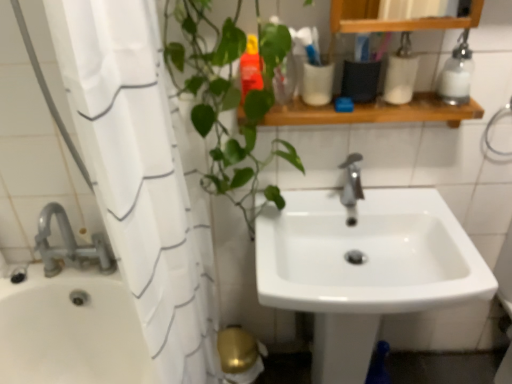
This screenshot has width=512, height=384. What do you see at coordinates (457, 73) in the screenshot? I see `clear glass soap dispenser at upper right` at bounding box center [457, 73].

Measure the distance between point (414, 250) and camera.

Point (414, 250) is 1.19 meters away from camera.

How much space does translucent orange bottle at upper center, placed as the second toiletry when sorted from right to left, occupy vertically?

translucent orange bottle at upper center, placed as the second toiletry when sorted from right to left, is 16.57 centimeters tall.

This screenshot has height=384, width=512. I want to click on translucent orange bottle at upper center, placed as the second toiletry when sorted from right to left, so click(250, 68).

This screenshot has height=384, width=512. What do you see at coordinates (140, 177) in the screenshot?
I see `white fabric shower curtain at left` at bounding box center [140, 177].

Where is `green leafy plant at left`? Image resolution: width=512 pixels, height=384 pixels. green leafy plant at left is located at coordinates (227, 100).

Can you confirm if clear glass soap dispenser at upper right is taller than white glossy container at upper right, the first toiletry viewed from the right?

Yes, clear glass soap dispenser at upper right is taller than white glossy container at upper right, the first toiletry viewed from the right.

How many degrees apart are the facing directions of clear glass soap dispenser at upper right and white glossy container at upper right, the first toiletry viewed from the right?

The facing directions of clear glass soap dispenser at upper right and white glossy container at upper right, the first toiletry viewed from the right, are 1.2 degrees apart.

Does point (469, 53) appear closer or farther from the camera than point (405, 35)?

Point (469, 53) is positioned farther from the camera compared to point (405, 35).

Is clear glass soap dispenser at upper right looking in the opposite direction of white glossy container at upper right, the first toiletry viewed from the right?

clear glass soap dispenser at upper right does not have its back to white glossy container at upper right, the first toiletry viewed from the right.

Is white fabric shower curtain at left looking in the opposite direction of white glossy container at upper right, the first toiletry viewed from the right?

No, white fabric shower curtain at left is not facing the opposite direction of white glossy container at upper right, the first toiletry viewed from the right.

Considering the sizes of objects white fabric shower curtain at left and white glossy container at upper right, which ranks as the second toiletry in left-to-right order, in the image provided, who is shorter, white fabric shower curtain at left or white glossy container at upper right, which ranks as the second toiletry in left-to-right order,?

white glossy container at upper right, which ranks as the second toiletry in left-to-right order, is shorter.

From the image's perspective, which one is positioned lower, white fabric shower curtain at left or white glossy container at upper right, which ranks as the second toiletry in left-to-right order?

From the image's view, white fabric shower curtain at left is below.

Which is nearer, [50,19] or [401,75]?

Positioned in front is point [50,19].

Which object is further away from the camera, white glossy container at upper right, the first toiletry viewed from the right, or green leafy plant at left?

white glossy container at upper right, the first toiletry viewed from the right, is further from the camera.

From the image's perspective, which object appears higher, white glossy container at upper right, which ranks as the second toiletry in left-to-right order, or green leafy plant at left?

white glossy container at upper right, which ranks as the second toiletry in left-to-right order, appears higher in the image.

Visually, is white glossy container at upper right, the first toiletry viewed from the right, positioned to the left or to the right of green leafy plant at left?

white glossy container at upper right, the first toiletry viewed from the right, is positioned on green leafy plant at left's right side.

Is white glossy container at upper right, the first toiletry viewed from the right, wider or thinner than green leafy plant at left?

Clearly, white glossy container at upper right, the first toiletry viewed from the right, has less width compared to green leafy plant at left.

From the image's perspective, relative to translucent orange bottle at upper center, positioned as the 1th toiletry in left-to-right order, is white glossy container at upper right, the first toiletry viewed from the right, above or below?

Clearly, from the image's perspective, white glossy container at upper right, the first toiletry viewed from the right, is above translucent orange bottle at upper center, positioned as the 1th toiletry in left-to-right order.

Would you say white glossy container at upper right, which ranks as the second toiletry in left-to-right order, is inside or outside translucent orange bottle at upper center, placed as the second toiletry when sorted from right to left?

Answer: white glossy container at upper right, which ranks as the second toiletry in left-to-right order, exists outside the volume of translucent orange bottle at upper center, placed as the second toiletry when sorted from right to left.

Is white glossy container at upper right, which ranks as the second toiletry in left-to-right order, turned away from translucent orange bottle at upper center, positioned as the 1th toiletry in left-to-right order?

white glossy container at upper right, which ranks as the second toiletry in left-to-right order, is not turned away from translucent orange bottle at upper center, positioned as the 1th toiletry in left-to-right order.

Is translucent orange bottle at upper center, positioned as the 1th toiletry in left-to-right order, completely or partially inside green leafy plant at left?

Yes, green leafy plant at left is surrounding translucent orange bottle at upper center, positioned as the 1th toiletry in left-to-right order.

Considering the points (269, 54) and (253, 55), which point is in front, point (269, 54) or point (253, 55)?

The point (269, 54) is closer to the camera.

From a real-world perspective, relative to translucent orange bottle at upper center, positioned as the 1th toiletry in left-to-right order, is green leafy plant at left vertically above or below?

green leafy plant at left is below translucent orange bottle at upper center, positioned as the 1th toiletry in left-to-right order.

Between translucent orange bottle at upper center, positioned as the 1th toiletry in left-to-right order, and green leafy plant at left, which one has larger size?

green leafy plant at left.

From a real-world perspective, starting from the green leafy plant at left, which toiletry is the 1st one vertically above it? Please provide its 2D coordinates.

[(250, 68)]

Does translucent orange bottle at upper center, placed as the second toiletry when sorted from right to left, lie in front of green leafy plant at left?

That is False.

Is translucent orange bottle at upper center, placed as the second toiletry when sorted from right to left, taller or shorter than green leafy plant at left?

Considering their sizes, translucent orange bottle at upper center, placed as the second toiletry when sorted from right to left, has less height than green leafy plant at left.

Which object is closer to the camera taking this photo, white glossy sink at center or clear glass soap dispenser at upper right?

white glossy sink at center.

Could you tell me if white glossy sink at center is turned towards clear glass soap dispenser at upper right?

No.

Is white glossy sink at center bigger or smaller than clear glass soap dispenser at upper right?

Clearly, white glossy sink at center is larger in size than clear glass soap dispenser at upper right.

Locate an element on the screen. The width and height of the screenshot is (512, 384). the 1st toiletry behind the clear glass soap dispenser at upper right is located at coordinates (401, 73).

The height and width of the screenshot is (384, 512). What are the coordinates of `shower curtain in front of the white glossy container at upper right, which ranks as the second toiletry in left-to-right order` in the screenshot? It's located at [x=140, y=177].

Considering their positions, is white glossy container at upper right, the first toiletry viewed from the right, positioned closer to white glossy sink at center than clear glass soap dispenser at upper right?

Based on the image, white glossy container at upper right, the first toiletry viewed from the right, appears to be nearer to white glossy sink at center.

Estimate the real-world distances between objects in this image. Which object is further from clear glass soap dispenser at upper right, white glossy container at upper right, the first toiletry viewed from the right, or wooden shelf at upper center?

The object further to clear glass soap dispenser at upper right is wooden shelf at upper center.

Estimate the real-world distances between objects in this image. Which object is further from green leafy plant at left, white fabric shower curtain at left or translucent orange bottle at upper center, positioned as the 1th toiletry in left-to-right order?

white fabric shower curtain at left is positioned further to the anchor green leafy plant at left.

Considering their positions, is green leafy plant at left positioned further to white fabric shower curtain at left than translucent orange bottle at upper center, placed as the second toiletry when sorted from right to left?

translucent orange bottle at upper center, placed as the second toiletry when sorted from right to left, lies further to white fabric shower curtain at left than the other object.

Based on their spatial positions, is green leafy plant at left or translucent orange bottle at upper center, positioned as the 1th toiletry in left-to-right order, closer to white glossy sink at center?

green leafy plant at left lies closer to white glossy sink at center than the other object.

Based on their spatial positions, is white glossy container at upper right, which ranks as the second toiletry in left-to-right order, or translucent orange bottle at upper center, positioned as the 1th toiletry in left-to-right order, closer to wooden shelf at upper center?

white glossy container at upper right, which ranks as the second toiletry in left-to-right order, lies closer to wooden shelf at upper center than the other object.

Which object lies further to the anchor point clear glass soap dispenser at upper right, green leafy plant at left or white glossy container at upper right, the first toiletry viewed from the right?

green leafy plant at left is positioned further to the anchor clear glass soap dispenser at upper right.

Looking at this image, considering their positions, is white fabric shower curtain at left positioned further to clear glass soap dispenser at upper right than white glossy container at upper right, which ranks as the second toiletry in left-to-right order?

white fabric shower curtain at left is positioned further to the anchor clear glass soap dispenser at upper right.

Where is `vegetation between white fabric shower curtain at left and clear glass soap dispenser at upper right in the horizontal direction`? vegetation between white fabric shower curtain at left and clear glass soap dispenser at upper right in the horizontal direction is located at coordinates (227, 100).

The width and height of the screenshot is (512, 384). Identify the location of shower curtain between clear glass soap dispenser at upper right and white glossy sink at center in the vertical direction. (140, 177).

Identify the location of shower curtain between green leafy plant at left and white glossy sink at center in the vertical direction. (140, 177).

Locate an element on the screen. This screenshot has width=512, height=384. vegetation between translucent orange bottle at upper center, positioned as the 1th toiletry in left-to-right order, and white fabric shower curtain at left from top to bottom is located at coordinates point(227,100).